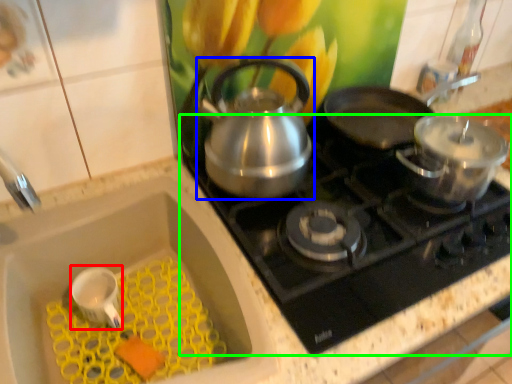
Question: Based on their relative distances, which object is farther from appliance (highlighted by a red box)? Choose from kettle (highlighted by a blue box) and gas stove (highlighted by a green box).

Choices:
 (A) kettle
 (B) gas stove

Answer: (B)